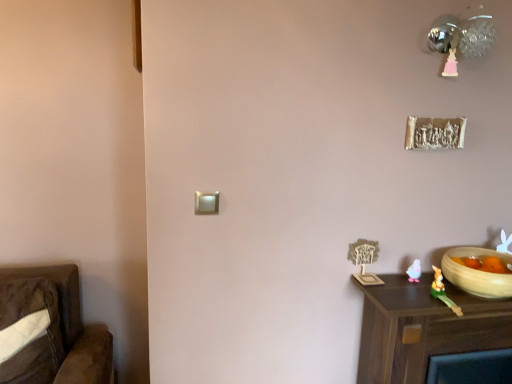
Identify the location of free point in front of pink plastic toy at lower right, marked as the first toy in a back-to-front arrangement. This screenshot has height=384, width=512. (404, 299).